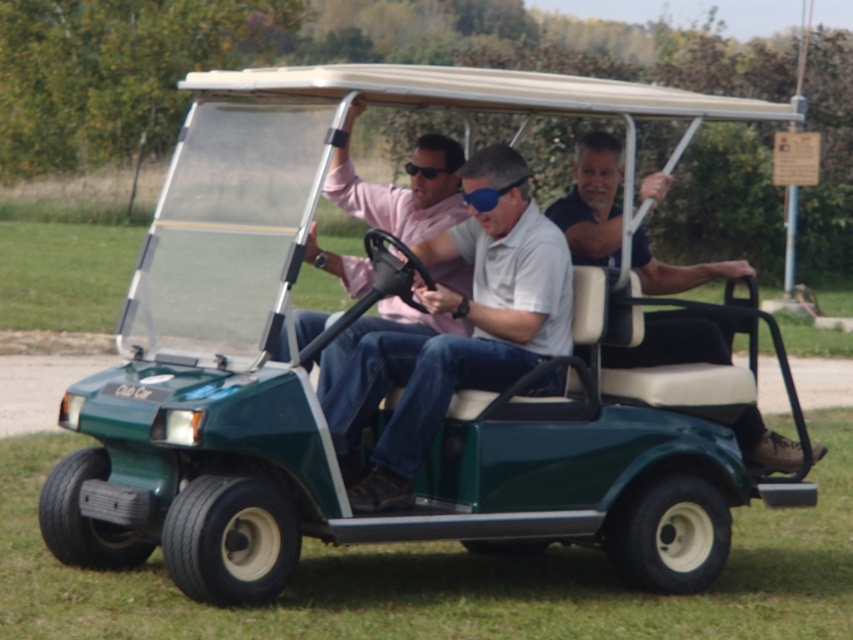
Which of these two, light blue cotton shirt at center or blue matte goggles at center, stands shorter?

Standing shorter between the two is light blue cotton shirt at center.

Who is more forward, (445, 355) or (405, 170)?

Positioned in front is point (445, 355).

The image size is (853, 640). I want to click on light blue cotton shirt at center, so click(477, 316).

Does blue denim jeans at center lie in front of blue matte goggles at center?

Yes, blue denim jeans at center is in front of blue matte goggles at center.

Does blue denim jeans at center have a greater width compared to blue matte goggles at center?

No, blue denim jeans at center is not wider than blue matte goggles at center.

Which is in front, point (752, 445) or point (434, 177)?

Point (434, 177)

This screenshot has height=640, width=853. Find the location of `blue denim jeans at center`. blue denim jeans at center is located at coordinates (592, 202).

Does light blue cotton shirt at center have a larger size compared to blue denim jeans at center?

Yes.

Does light blue cotton shirt at center have a lesser width compared to blue denim jeans at center?

In fact, light blue cotton shirt at center might be wider than blue denim jeans at center.

Which is in front, point (546, 225) or point (602, 358)?

Point (546, 225) is in front.

At what (x,y) coordinates should I click in order to perform the action: click on light blue cotton shirt at center. Please return your answer as a coordinate pair (x, y). The width and height of the screenshot is (853, 640). Looking at the image, I should click on (477, 316).